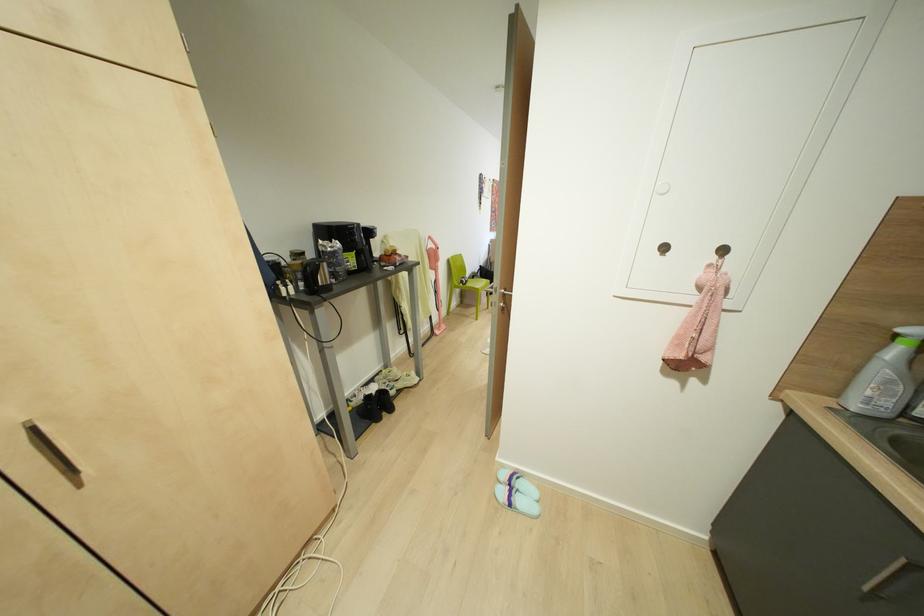
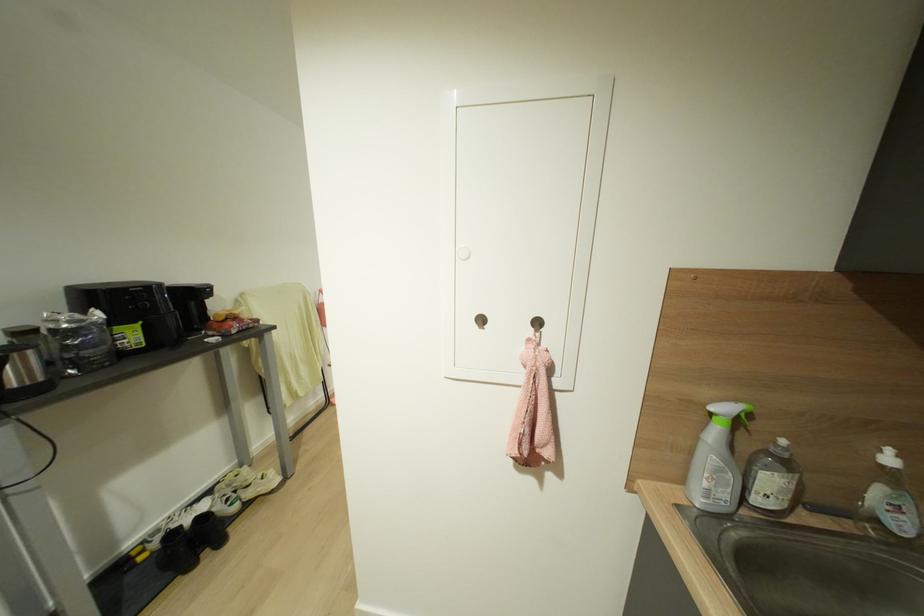
The point at (383, 378) is marked in the first image. Where is the corresponding point in the second image?

(227, 485)